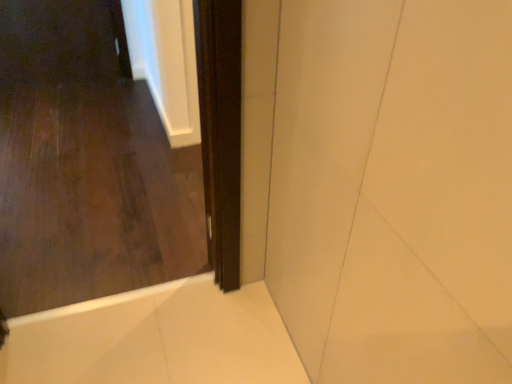
Question: From a real-world perspective, is dark wood door at center positioned above or below white glossy bath at lower right?

Choices:
 (A) above
 (B) below

Answer: (A)

Question: Considering the positions of dark wood door at center and white glossy bath at lower right in the image, is dark wood door at center taller or shorter than white glossy bath at lower right?

Choices:
 (A) tall
 (B) short

Answer: (A)

Question: Which object is positioned closest to the white glossy bath at lower right?

Choices:
 (A) dark wood door at center
 (B) dark wood screen door at center

Answer: (A)

Question: Estimate the real-world distances between objects in this image. Which object is farther from the dark wood door at center?

Choices:
 (A) dark wood screen door at center
 (B) white glossy bath at lower right

Answer: (A)